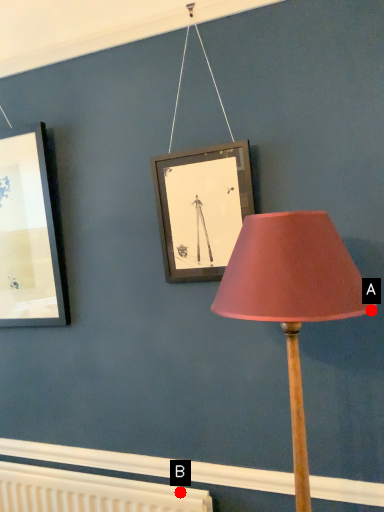
Question: Two points are circled on the image, labeled by A and B beside each circle. Which point is farther from the camera taking this photo?

Choices:
 (A) A is further
 (B) B is further

Answer: (B)